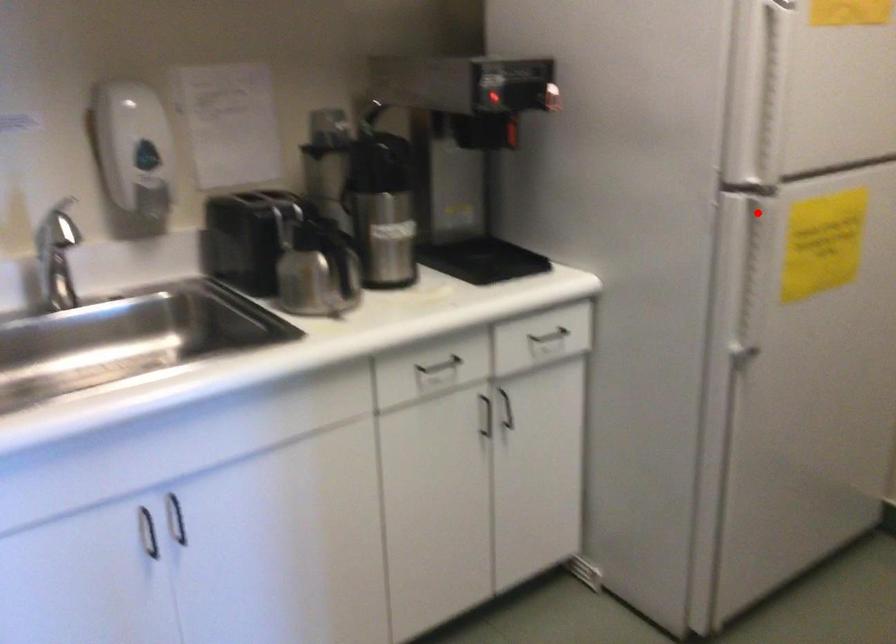
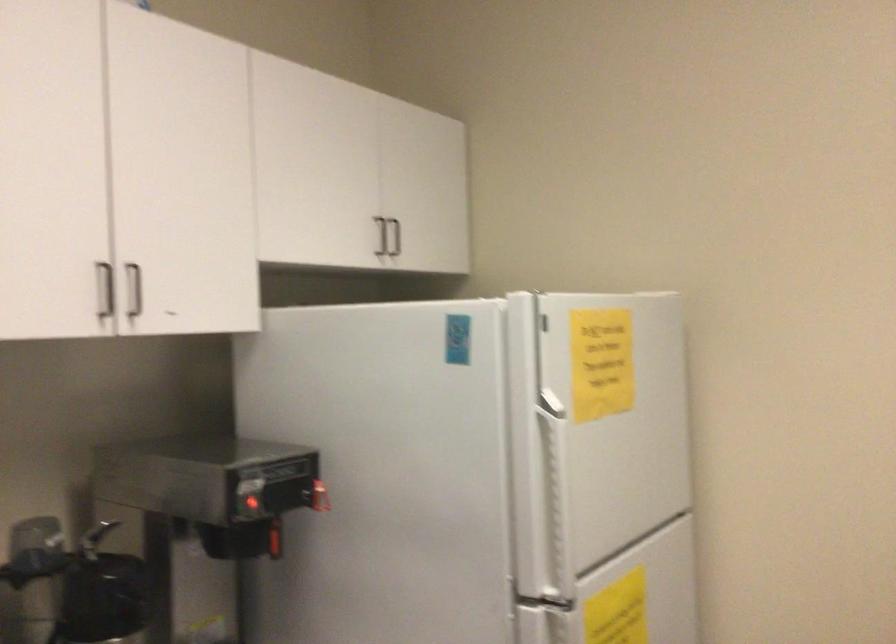
In the second image, find the point that corresponds to the highlighted location in the first image.

(558, 627)